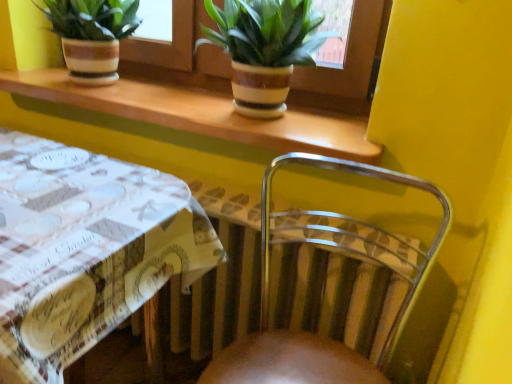
Question: Is clear plastic chair at lower right with green leafy plant in striped pot at upper center, acting as the second houseplant starting from the left?

Choices:
 (A) yes
 (B) no

Answer: (B)

Question: Could you tell me if clear plastic chair at lower right is facing green leafy plant in striped pot at upper center, acting as the second houseplant starting from the left?

Choices:
 (A) yes
 (B) no

Answer: (B)

Question: From a real-world perspective, is clear plastic chair at lower right over green leafy plant in striped pot at upper center, the first houseplant positioned from the right?

Choices:
 (A) yes
 (B) no

Answer: (B)

Question: Is clear plastic chair at lower right thinner than green leafy plant in striped pot at upper center, the first houseplant positioned from the right?

Choices:
 (A) yes
 (B) no

Answer: (B)

Question: Is clear plastic chair at lower right oriented away from green leafy plant in striped pot at upper center, acting as the second houseplant starting from the left?

Choices:
 (A) yes
 (B) no

Answer: (B)

Question: Would you say clear plastic chair at lower right is outside green leafy plant in striped pot at upper center, the first houseplant positioned from the right?

Choices:
 (A) no
 (B) yes

Answer: (B)

Question: Can we say brown ceramic pots at upper center lies outside clear plastic chair at lower right?

Choices:
 (A) yes
 (B) no

Answer: (A)

Question: Could you tell me if brown ceramic pots at upper center is turned towards clear plastic chair at lower right?

Choices:
 (A) yes
 (B) no

Answer: (B)

Question: Considering the relative sizes of brown ceramic pots at upper center and clear plastic chair at lower right in the image provided, is brown ceramic pots at upper center taller than clear plastic chair at lower right?

Choices:
 (A) no
 (B) yes

Answer: (A)

Question: Does brown ceramic pots at upper center appear on the right side of clear plastic chair at lower right?

Choices:
 (A) yes
 (B) no

Answer: (B)

Question: From a real-world perspective, is brown ceramic pots at upper center physically above clear plastic chair at lower right?

Choices:
 (A) no
 (B) yes

Answer: (B)

Question: Does brown ceramic pots at upper center have a smaller size compared to clear plastic chair at lower right?

Choices:
 (A) yes
 (B) no

Answer: (A)

Question: Is clear plastic chair at lower right outside white printed fabric at lower left?

Choices:
 (A) yes
 (B) no

Answer: (A)